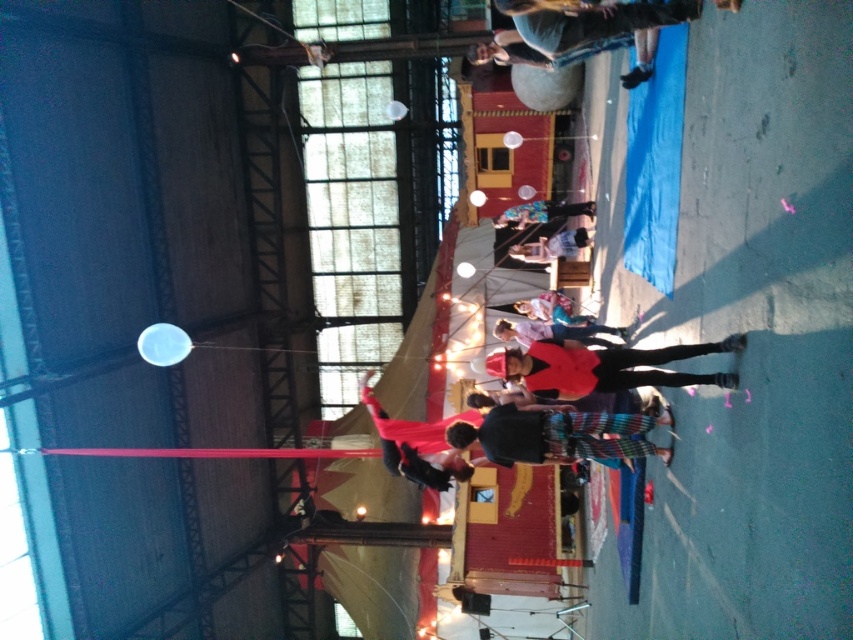
What do you see at coordinates (556, 332) in the screenshot?
I see `matte red shirt at center` at bounding box center [556, 332].

The height and width of the screenshot is (640, 853). In order to click on matte red shirt at center in this screenshot , I will do `click(556, 332)`.

Is point (527, 252) farther from viewer compared to point (561, 205)?

Yes, it is behind point (561, 205).

Which is more to the left, light blue denim jeans at center or blue denim jeans at center?

From the viewer's perspective, light blue denim jeans at center appears more on the left side.

Who is more forward, (555, 250) or (573, 208)?

Point (573, 208) is more forward.

Image resolution: width=853 pixels, height=640 pixels. Find the location of `light blue denim jeans at center`. light blue denim jeans at center is located at coordinates (552, 246).

Between matte red jacket at center and matte red shirt at center, which one is positioned higher?

matte red shirt at center is higher up.

Where is `matte red jacket at center`? This screenshot has height=640, width=853. matte red jacket at center is located at coordinates (604, 365).